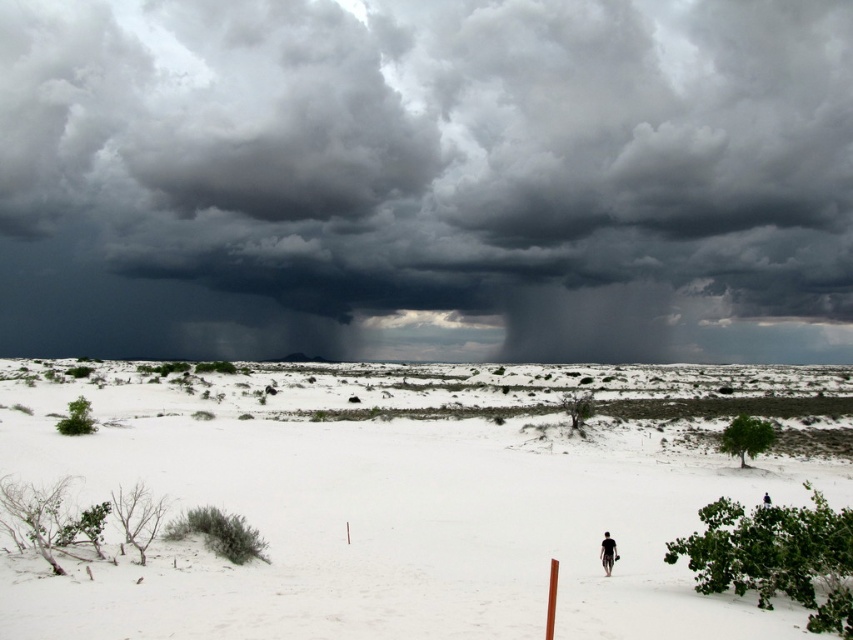
Looking at this image, you are standing on the white sand plain at center and looking towards the dark gray cloud at upper center. Which object is closer to your eyes?

The dark gray cloud at upper center is closer to your eyes because it is positioned further to the viewer than the white sand plain at center.